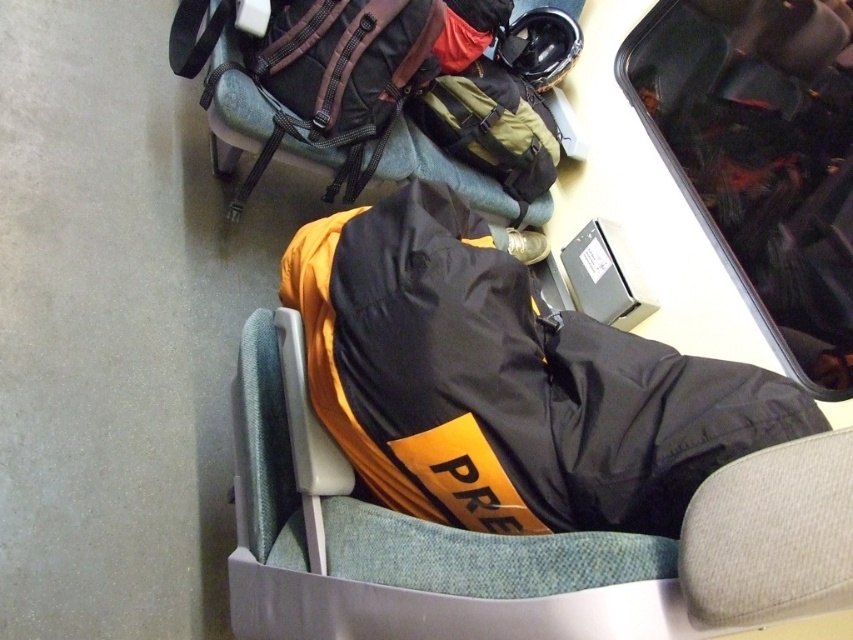
Question: Estimate the real-world distances between objects in this image. Which object is farther from the black matte jacket at center?

Choices:
 (A) matte green backpack at center
 (B) black fabric jacket at center
 (C) black matte suitcase at upper right

Answer: (A)

Question: Which point is farther from the camera taking this photo?

Choices:
 (A) click(x=775, y=36)
 (B) click(x=451, y=465)

Answer: (A)

Question: Does black fabric jacket at center have a larger size compared to matte green backpack at center?

Choices:
 (A) no
 (B) yes

Answer: (B)

Question: Does black fabric jacket at center appear on the right side of black matte suitcase at upper right?

Choices:
 (A) yes
 (B) no

Answer: (B)

Question: Does black matte suitcase at upper right appear on the left side of matte green backpack at center?

Choices:
 (A) no
 (B) yes

Answer: (A)

Question: Which point is farther to the camera?

Choices:
 (A) (515, 145)
 (B) (596, 538)
 (C) (759, 128)

Answer: (A)